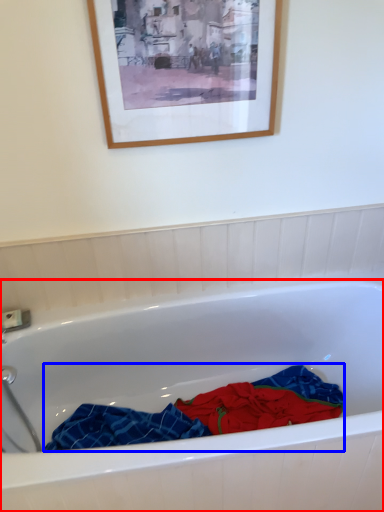
Question: Among these objects, which one is farthest to the camera, bathtub (highlighted by a red box) or material (highlighted by a blue box)?

Choices:
 (A) bathtub
 (B) material

Answer: (B)